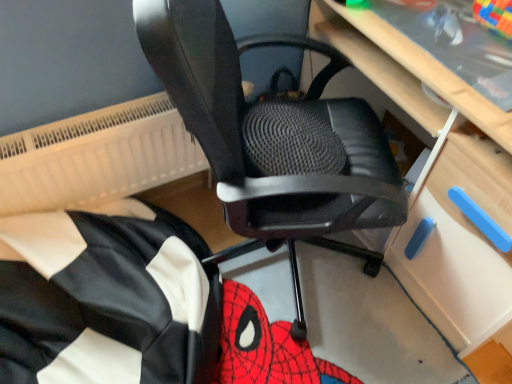
The width and height of the screenshot is (512, 384). What do you see at coordinates (96, 157) in the screenshot?
I see `white textured radiator at upper left` at bounding box center [96, 157].

Find the location of `white textured radiator at upper left`. white textured radiator at upper left is located at coordinates (96, 157).

Where is `white textured radiator at upper left`? Image resolution: width=512 pixels, height=384 pixels. white textured radiator at upper left is located at coordinates (96, 157).

From a real-world perspective, is white textured radiator at upper left physically below black fabric bean bag at lower left?

No.

Which of these two, white textured radiator at upper left or black fabric bean bag at lower left, stands shorter?

white textured radiator at upper left is shorter.

Does white textured radiator at upper left appear on the right side of black fabric bean bag at lower left?

Incorrect, white textured radiator at upper left is not on the right side of black fabric bean bag at lower left.

Choose the correct answer: Is white textured radiator at upper left inside black fabric bean bag at lower left or outside it?

white textured radiator at upper left is outside black fabric bean bag at lower left.

The height and width of the screenshot is (384, 512). Find the location of `chair below the white textured radiator at upper left (from the image's perspective)`. chair below the white textured radiator at upper left (from the image's perspective) is located at coordinates (272, 134).

Between black mesh office chair at center and white textured radiator at upper left, which one is positioned in front?

Positioned in front is black mesh office chair at center.

From a real-world perspective, which object rests below the other?

white textured radiator at upper left, from a real-world perspective.

Which is correct: black mesh office chair at center is inside white textured radiator at upper left, or outside of it?

black mesh office chair at center exists outside the volume of white textured radiator at upper left.

Are light wood computer desk at center and black mesh office chair at center far apart?

That's not correct — light wood computer desk at center is a little close to black mesh office chair at center.

From the picture: Is light wood computer desk at center turned away from black mesh office chair at center?

That's right, light wood computer desk at center is facing away from black mesh office chair at center.

Considering the relative sizes of light wood computer desk at center and black mesh office chair at center in the image provided, is light wood computer desk at center wider than black mesh office chair at center?

No.

Is light wood computer desk at center bigger than black mesh office chair at center?

Indeed, light wood computer desk at center has a larger size compared to black mesh office chair at center.

Is black fabric bean bag at lower left taller or shorter than black mesh office chair at center?

In the image, black fabric bean bag at lower left appears to be shorter than black mesh office chair at center.

Is black fabric bean bag at lower left completely or partially outside of black mesh office chair at center?

Yes, black fabric bean bag at lower left is outside of black mesh office chair at center.

Between black fabric bean bag at lower left and black mesh office chair at center, which one has smaller width?

black mesh office chair at center is thinner.

From a real-world perspective, which is physically below, black fabric bean bag at lower left or black mesh office chair at center?

From a 3D spatial view, black fabric bean bag at lower left is below.

Considering the positions of objects black mesh office chair at center and black fabric bean bag at lower left in the image provided, who is behind, black mesh office chair at center or black fabric bean bag at lower left?

black fabric bean bag at lower left.

Based on their sizes in the image, would you say black mesh office chair at center is bigger or smaller than black fabric bean bag at lower left?

Considering their sizes, black mesh office chair at center takes up more space than black fabric bean bag at lower left.

Between black mesh office chair at center and black fabric bean bag at lower left, which one appears on the right side from the viewer's perspective?

Positioned to the right is black mesh office chair at center.

Is point (225, 155) behind point (147, 225)?

No, it is in front of (147, 225).

Does black fabric bean bag at lower left turn towards white textured radiator at upper left?

No, black fabric bean bag at lower left is not oriented towards white textured radiator at upper left.

Which object is closer to the camera, black fabric bean bag at lower left or white textured radiator at upper left?

black fabric bean bag at lower left.

From the image's perspective, is black fabric bean bag at lower left located beneath white textured radiator at upper left?

Correct, black fabric bean bag at lower left appears lower than white textured radiator at upper left in the image.

Can you confirm if black fabric bean bag at lower left is positioned to the right of white textured radiator at upper left?

Yes, black fabric bean bag at lower left is to the right of white textured radiator at upper left.

In the scene shown: How different are the orientations of white textured radiator at upper left and light wood computer desk at center in degrees?

90.2 degrees.

Is white textured radiator at upper left completely or partially outside of light wood computer desk at center?

That's correct, white textured radiator at upper left is outside of light wood computer desk at center.

Considering the relative sizes of white textured radiator at upper left and light wood computer desk at center in the image provided, is white textured radiator at upper left shorter than light wood computer desk at center?

Yes.

In the scene shown: Which point is more distant from viewer, (10, 192) or (490, 276)?

The point (10, 192) is farther.

The width and height of the screenshot is (512, 384). Identify the location of bean bag chair located on the right of white textured radiator at upper left. (109, 301).

Where is `radiator that is behind the black mesh office chair at center`? This screenshot has width=512, height=384. radiator that is behind the black mesh office chair at center is located at coordinates (96, 157).

Which object lies nearer to the anchor point black mesh office chair at center, white textured radiator at upper left or black fabric bean bag at lower left?

white textured radiator at upper left lies closer to black mesh office chair at center than the other object.

From the image, which object appears to be farther from black fabric bean bag at lower left, light wood computer desk at center or black mesh office chair at center?

light wood computer desk at center.

From the image, which object appears to be farther from black mesh office chair at center, black fabric bean bag at lower left or white textured radiator at upper left?

The object further to black mesh office chair at center is black fabric bean bag at lower left.

Looking at the image, which one is located further to black mesh office chair at center, white textured radiator at upper left or light wood computer desk at center?

white textured radiator at upper left is positioned further to the anchor black mesh office chair at center.

Based on their spatial positions, is black fabric bean bag at lower left or light wood computer desk at center closer to black mesh office chair at center?

Among the two, light wood computer desk at center is located nearer to black mesh office chair at center.

Estimate the real-world distances between objects in this image. Which object is further from black fabric bean bag at lower left, white textured radiator at upper left or black mesh office chair at center?

black mesh office chair at center is positioned further to the anchor black fabric bean bag at lower left.

Considering their positions, is black mesh office chair at center positioned further to light wood computer desk at center than black fabric bean bag at lower left?

Based on the image, black fabric bean bag at lower left appears to be further to light wood computer desk at center.

Considering their positions, is black fabric bean bag at lower left positioned closer to light wood computer desk at center than white textured radiator at upper left?

Based on the image, white textured radiator at upper left appears to be nearer to light wood computer desk at center.

The width and height of the screenshot is (512, 384). In order to click on chair between black fabric bean bag at lower left and light wood computer desk at center in the horizontal direction in this screenshot , I will do `click(272, 134)`.

Locate an element on the screen. The width and height of the screenshot is (512, 384). chair between white textured radiator at upper left and light wood computer desk at center is located at coordinates (272, 134).

The image size is (512, 384). What are the coordinates of `bean bag chair located between white textured radiator at upper left and light wood computer desk at center in the left-right direction` in the screenshot? It's located at (109, 301).

Locate an element on the screen. This screenshot has height=384, width=512. bean bag chair between white textured radiator at upper left and black mesh office chair at center is located at coordinates (109, 301).